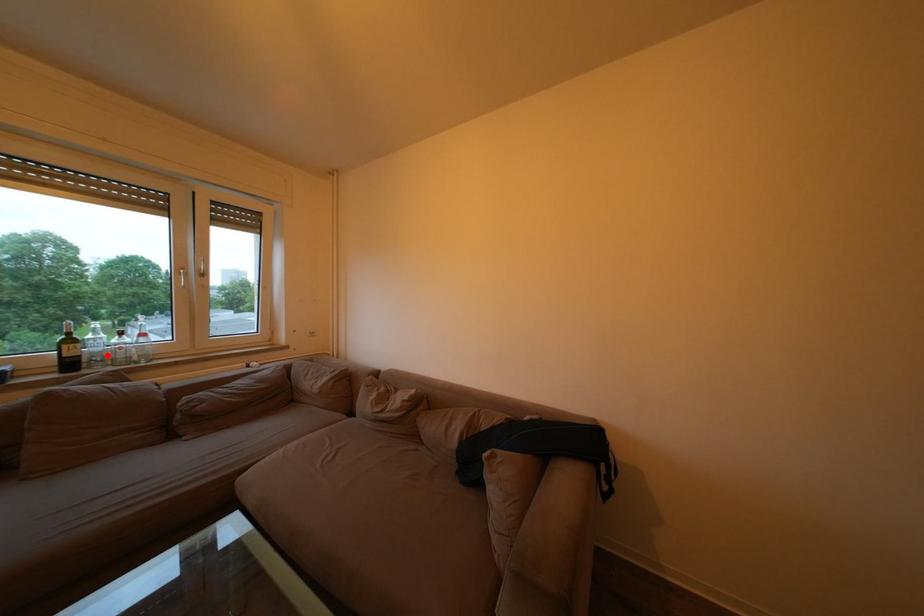
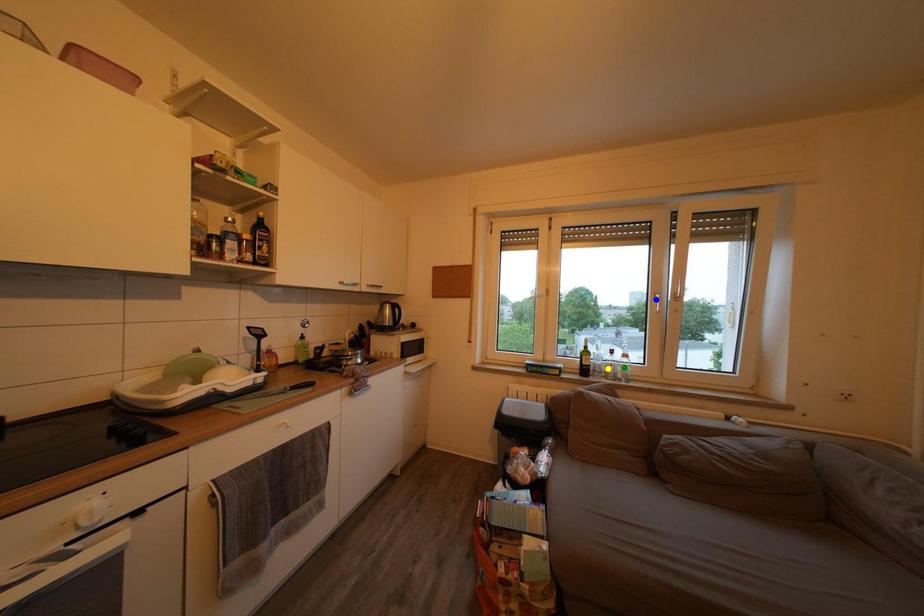
Question: I am providing you with two images of the same scene from different viewpoints. A red point is marked on the first image. You are given multiple points on the second image. Which mark in image 2 goes with the point in image 1?

Choices:
 (A) blue point
 (B) green point
 (C) yellow point

Answer: (C)